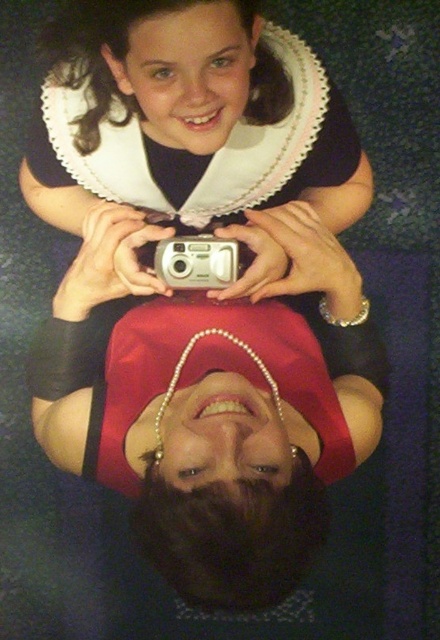
Measure the distance between pearl necklace at center and camera.

pearl necklace at center and camera are 34.95 inches apart from each other.

Is point (158, 228) closer to camera compared to point (213, 237)?

No.

Locate an element on the screen. Image resolution: width=440 pixels, height=640 pixels. pearl necklace at center is located at coordinates (213, 406).